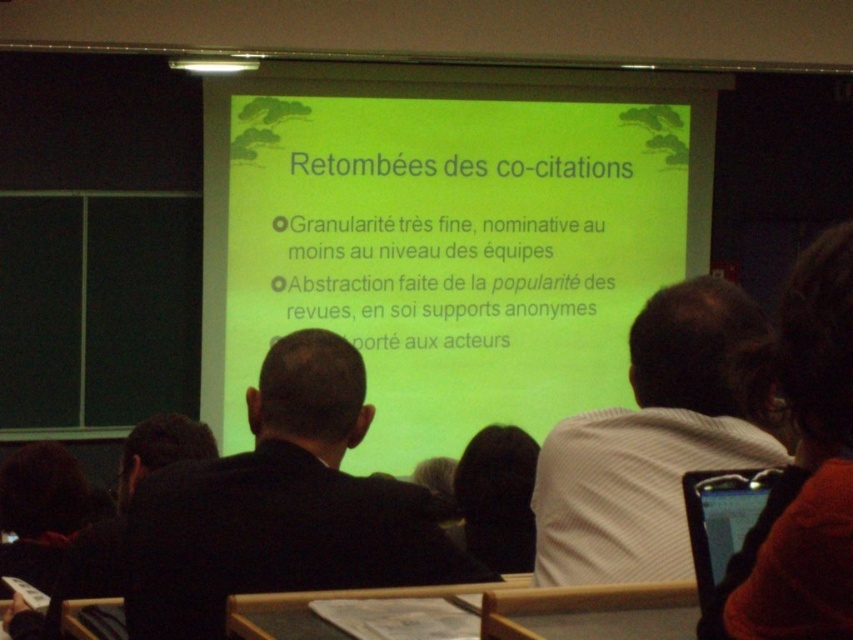
Question: Does black suit at center appear under white striped shirt at right?

Choices:
 (A) yes
 (B) no

Answer: (A)

Question: Which object is the closest to the green matte projection screen at center?

Choices:
 (A) white striped shirt at right
 (B) black suit at center
 (C) matte black phone at lower right

Answer: (B)

Question: Is green matte projection screen at center wider than black suit at center?

Choices:
 (A) yes
 (B) no

Answer: (A)

Question: Is black suit at center bigger than matte black phone at lower right?

Choices:
 (A) no
 (B) yes

Answer: (B)

Question: Which point appears farthest from the camera in this image?

Choices:
 (A) (200, 544)
 (B) (695, 288)
 (C) (717, 579)
 (D) (318, 228)

Answer: (D)

Question: Considering the real-world distances, which object is closest to the black suit at center?

Choices:
 (A) green matte projection screen at center
 (B) white striped shirt at right
 (C) matte black phone at lower right

Answer: (B)